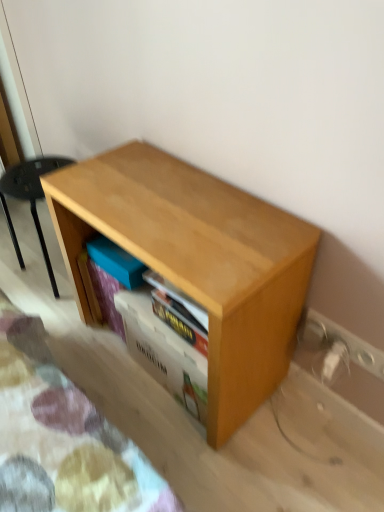
Question: Can you confirm if light wood shelf at lower left is shorter than wooden shelf at center?

Choices:
 (A) yes
 (B) no

Answer: (B)

Question: From the image's perspective, would you say light wood shelf at lower left is positioned over wooden shelf at center?

Choices:
 (A) yes
 (B) no

Answer: (A)

Question: Can you confirm if light wood shelf at lower left is smaller than wooden shelf at center?

Choices:
 (A) no
 (B) yes

Answer: (A)

Question: Would you say light wood shelf at lower left contains wooden shelf at center?

Choices:
 (A) no
 (B) yes

Answer: (A)

Question: Can you confirm if light wood shelf at lower left is wider than wooden shelf at center?

Choices:
 (A) yes
 (B) no

Answer: (A)

Question: Considering the positions of white plastic electric outlet at lower right, which ranks as the 1th electric outlet in bottom-to-top order, and wooden shelf at center in the image, is white plastic electric outlet at lower right, which ranks as the 1th electric outlet in bottom-to-top order, taller or shorter than wooden shelf at center?

Choices:
 (A) short
 (B) tall

Answer: (A)

Question: Considering the positions of white plastic electric outlet at lower right, which ranks as the 1th electric outlet in bottom-to-top order, and wooden shelf at center in the image, is white plastic electric outlet at lower right, which ranks as the 1th electric outlet in bottom-to-top order, bigger or smaller than wooden shelf at center?

Choices:
 (A) small
 (B) big

Answer: (A)

Question: Considering the positions of white plastic electric outlet at lower right, which ranks as the 1th electric outlet in bottom-to-top order, and wooden shelf at center in the image, is white plastic electric outlet at lower right, which ranks as the 1th electric outlet in bottom-to-top order, wider or thinner than wooden shelf at center?

Choices:
 (A) thin
 (B) wide

Answer: (A)

Question: Considering the positions of point (332, 371) and point (175, 396), is point (332, 371) closer or farther from the camera than point (175, 396)?

Choices:
 (A) closer
 (B) farther

Answer: (A)

Question: In terms of size, does wooden shelf at center appear bigger or smaller than white plastic electric outlet at lower right, which is counted as the second electric outlet, starting from the bottom?

Choices:
 (A) big
 (B) small

Answer: (A)

Question: In the image, is wooden shelf at center positioned in front of or behind white plastic electric outlet at lower right, which ranks as the 1th electric outlet in top-to-bottom order?

Choices:
 (A) front
 (B) behind

Answer: (A)

Question: From the image's perspective, is wooden shelf at center above or below white plastic electric outlet at lower right, which ranks as the 1th electric outlet in top-to-bottom order?

Choices:
 (A) below
 (B) above

Answer: (A)

Question: Choose the correct answer: Is wooden shelf at center inside white plastic electric outlet at lower right, which is counted as the second electric outlet, starting from the bottom, or outside it?

Choices:
 (A) inside
 (B) outside

Answer: (B)

Question: From the image's perspective, is light wood shelf at lower left above or below white plastic electric outlet at lower right, which is the 2th electric outlet from top to bottom?

Choices:
 (A) below
 (B) above

Answer: (B)

Question: Is light wood shelf at lower left wider or thinner than white plastic electric outlet at lower right, which is the 2th electric outlet from top to bottom?

Choices:
 (A) wide
 (B) thin

Answer: (A)